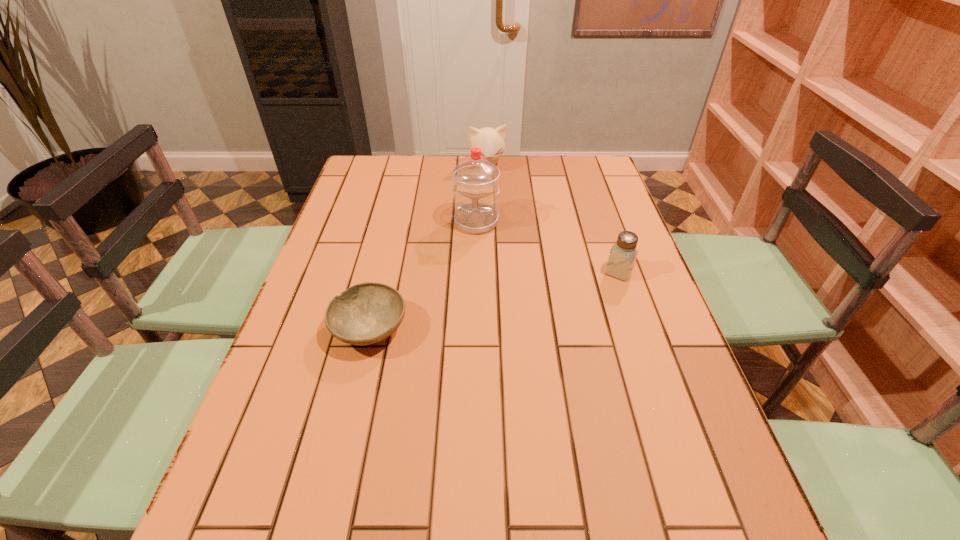
At what (x,y) coordinates should I click in order to perform the action: click on vacant space that's between the farthest object and the leftmost object. Please return your answer as a coordinate pair (x, y). Image resolution: width=960 pixels, height=540 pixels. Looking at the image, I should click on (428, 248).

At what (x,y) coordinates should I click in order to perform the action: click on free space between the third shortest object and the bowl. Please return your answer as a coordinate pair (x, y). Looking at the image, I should click on (428, 248).

Locate an element on the screen. free space between the kitten and the rightmost object is located at coordinates (553, 219).

Select which object appears as the closest to the nearest object. Please provide its 2D coordinates. Your answer should be formatted as a tuple, i.e. [(x, y)], where the tuple contains the x and y coordinates of a point satisfying the conditions above.

[(475, 181)]

Identify which object is the third nearest to the rightmost object. Please provide its 2D coordinates. Your answer should be formatted as a tuple, i.e. [(x, y)], where the tuple contains the x and y coordinates of a point satisfying the conditions above.

[(491, 141)]

What are the coordinates of `free region that satisfies the following two spatial constraints: 1. on the back side of the third shortest object; 2. on the right side of the tallest object` in the screenshot? It's located at (477, 167).

Image resolution: width=960 pixels, height=540 pixels. In order to click on vacant space that satisfies the following two spatial constraints: 1. on the back side of the nearest object; 2. on the left side of the second tallest object in this screenshot , I will do point(408,167).

At what (x,y) coordinates should I click in order to perform the action: click on vacant space that satisfies the following two spatial constraints: 1. on the front side of the kitten; 2. on the right side of the saltshaker. Please return your answer as a coordinate pair (x, y). This screenshot has height=540, width=960. Looking at the image, I should click on (490, 272).

What are the coordinates of `blank space that satisfies the following two spatial constraints: 1. on the back side of the bowl; 2. on the right side of the second shortest object` in the screenshot? It's located at (383, 272).